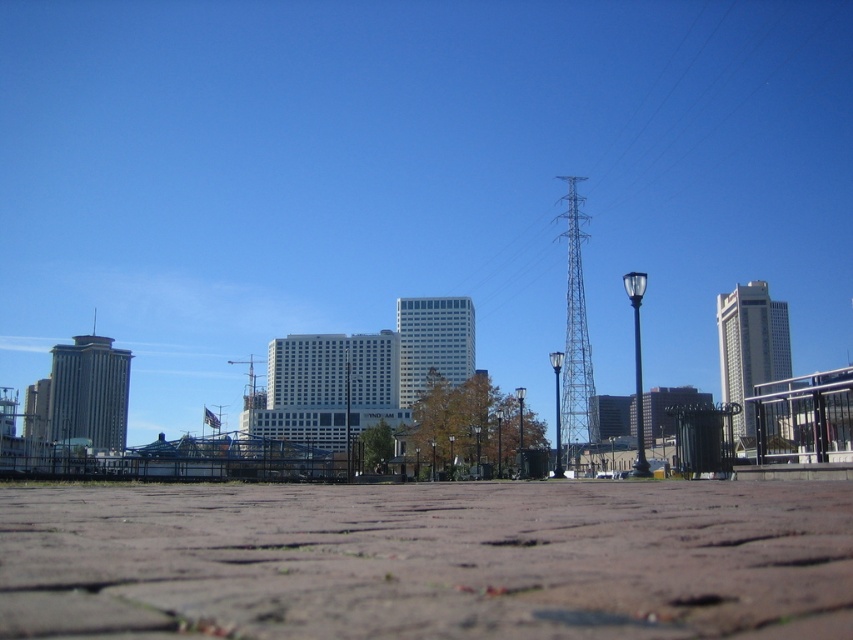
You are standing at the center of the paved area and want to take a photo of the white glass building at center. Since the lampposts are in the way, which direction should you move to avoid them?

Since the white glass building at center is located at point (433, 342), you should move to the left or right to avoid the lampposts positioned along the edge of the paved area.